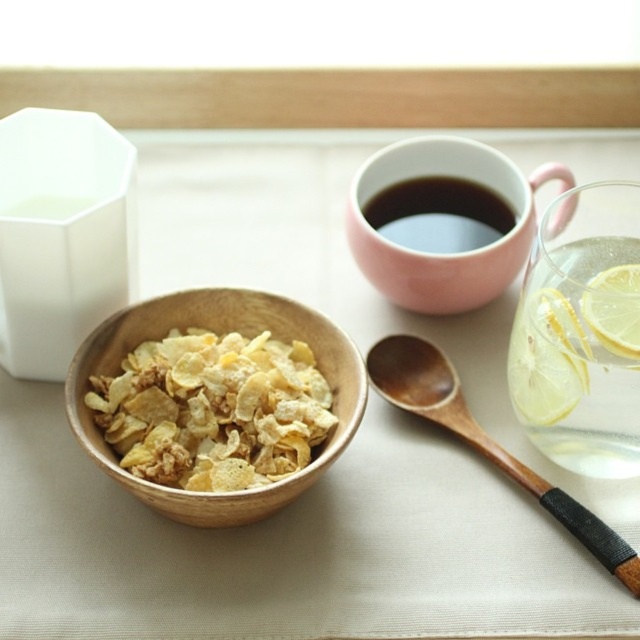
You are setting up a breakfast tray and need to place the wooden spoon at lower right and the matte pink cup at upper center. Based on their positions, which object is closer to the edge of the table?

The wooden spoon at lower right is positioned under the matte pink cup at upper center, so the wooden spoon at lower right is closer to the edge of the table.

You are setting up a small tray for a picnic and need to place both the wooden spoon at lower right and the yellow translucent lemon at right. The tray has a narrow slot that can only accommodate items up to 3 inches in width. Based on the scene description, which item is more likely to fit through the slot?

The yellow translucent lemon at right is more likely to fit through the slot since the wooden spoon at lower right might be wider than it according to the description.